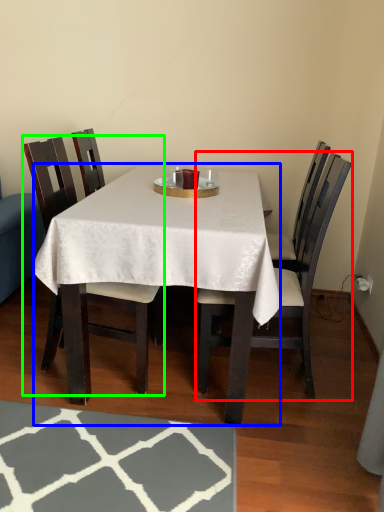
Question: Considering the real-world distances, which object is closest to chair (highlighted by a red box)? desk (highlighted by a blue box) or chair (highlighted by a green box).

Choices:
 (A) desk
 (B) chair

Answer: (A)